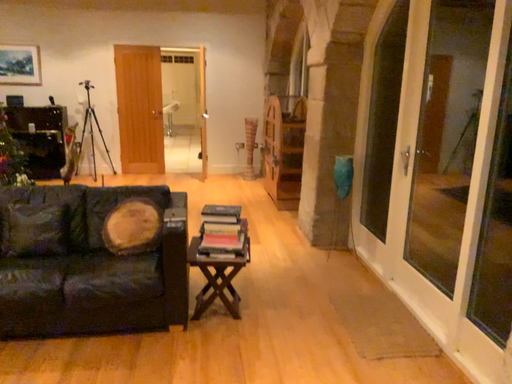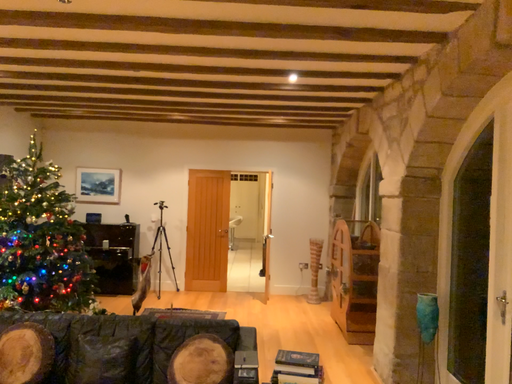
Question: How did the camera likely rotate when shooting the video?

Choices:
 (A) rotated left
 (B) rotated right

Answer: (A)